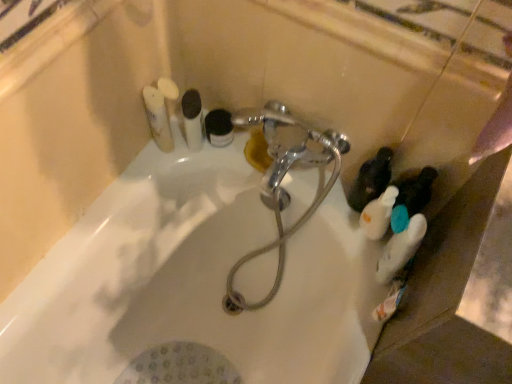
This screenshot has width=512, height=384. I want to click on vacant space to the right of white matte toothpaste tube at upper left, which appears as the 6th toiletry when viewed from the right, so click(x=219, y=154).